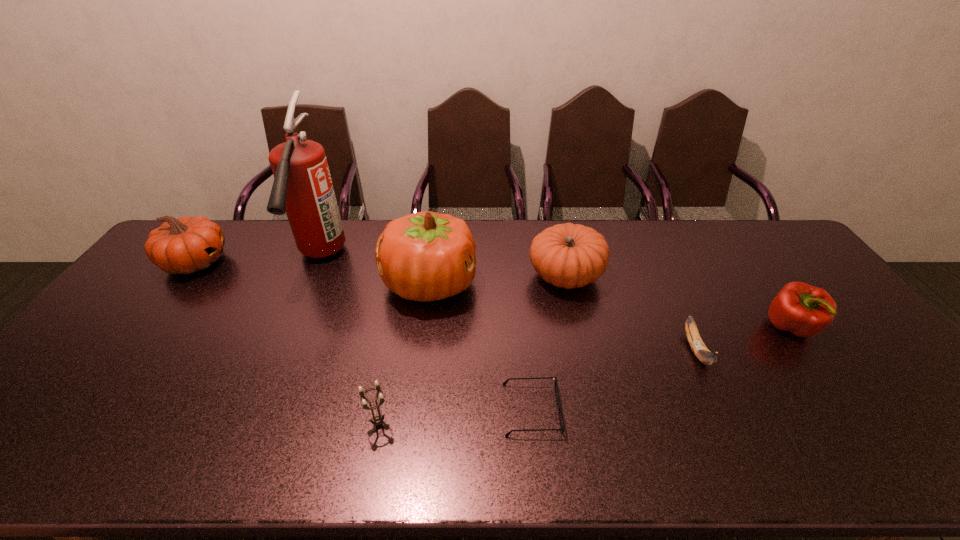
What are the coordinates of `object that is the seventh closest to the candle holder` in the screenshot? It's located at (804, 310).

Identify which object is located as the fifth nearest to the leftmost object. Please provide its 2D coordinates. Your answer should be formatted as a tuple, i.e. [(x, y)], where the tuple contains the x and y coordinates of a point satisfying the conditions above.

[(567, 255)]

Where is `the closest pumpkin to the leftmost pumpkin`? The height and width of the screenshot is (540, 960). the closest pumpkin to the leftmost pumpkin is located at coordinates (425, 256).

Where is `the closest pumpkin to the leftmost object`? the closest pumpkin to the leftmost object is located at coordinates (425, 256).

Locate an element on the screen. vacant space that satisfies the following two spatial constraints: 1. at the nozzle of the tallest object; 2. on the right side of the candle holder is located at coordinates (248, 423).

Image resolution: width=960 pixels, height=540 pixels. Identify the location of free region that satisfies the following two spatial constraints: 1. at the nozzle of the tallest object; 2. on the face of the leftmost object. (319, 262).

Where is `free space that satisfies the following two spatial constraints: 1. on the front side of the rightmost pumpkin; 2. on the front-facing side of the shortest object`? free space that satisfies the following two spatial constraints: 1. on the front side of the rightmost pumpkin; 2. on the front-facing side of the shortest object is located at coordinates (596, 409).